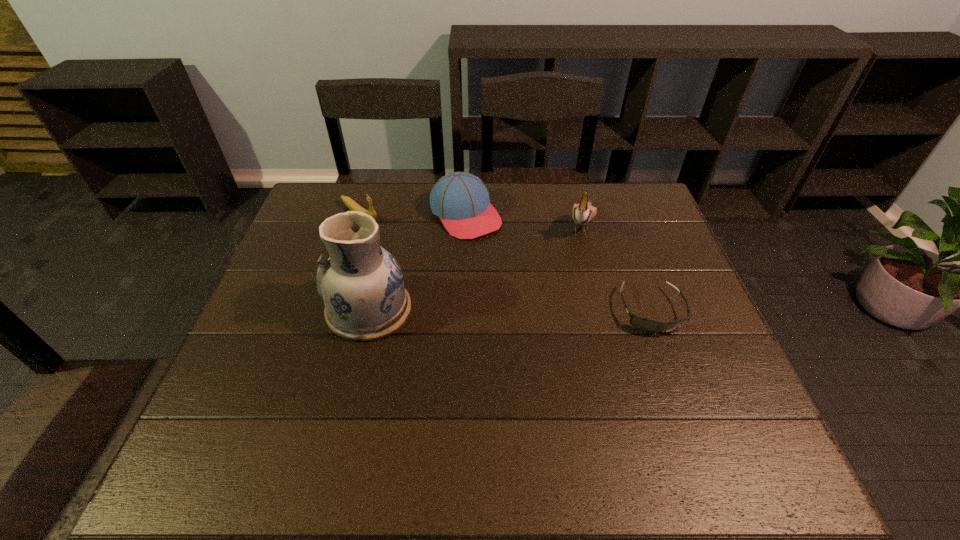
The image size is (960, 540). Find the location of `blank area located 0.260m at the stem of the banana`. blank area located 0.260m at the stem of the banana is located at coordinates (428, 262).

The image size is (960, 540). I want to click on blank space located at the stem of the banana, so click(419, 255).

You are a GUI agent. You are given a task and a screenshot of the screen. Output one action in this format:
    pyautogui.click(x=<x>, y=<y>)
    Task: Click on the free space located at the stem of the banana
    The width and height of the screenshot is (960, 540).
    Given the screenshot: What is the action you would take?
    pyautogui.click(x=401, y=243)

This screenshot has height=540, width=960. I want to click on vacant space located on the front-facing side of the third object from right to left, so click(x=499, y=256).

Image resolution: width=960 pixels, height=540 pixels. I want to click on vacant space located 0.160m on the front-facing side of the third object from right to left, so 512,271.

At what (x,y) coordinates should I click in order to perform the action: click on free point located on the front-facing side of the third object from right to left. Please return your answer as a coordinate pair (x, y). This screenshot has width=960, height=540. Looking at the image, I should click on (522, 282).

This screenshot has width=960, height=540. Identify the location of bird at the far edge. coord(583,213).

Find the location of a particular element. The height and width of the screenshot is (540, 960). banana at the far edge is located at coordinates (350, 203).

The width and height of the screenshot is (960, 540). In order to click on baseball cap that is at the far edge in this screenshot , I will do `click(461, 200)`.

Where is `object situated at the left edge`? This screenshot has height=540, width=960. object situated at the left edge is located at coordinates (350, 203).